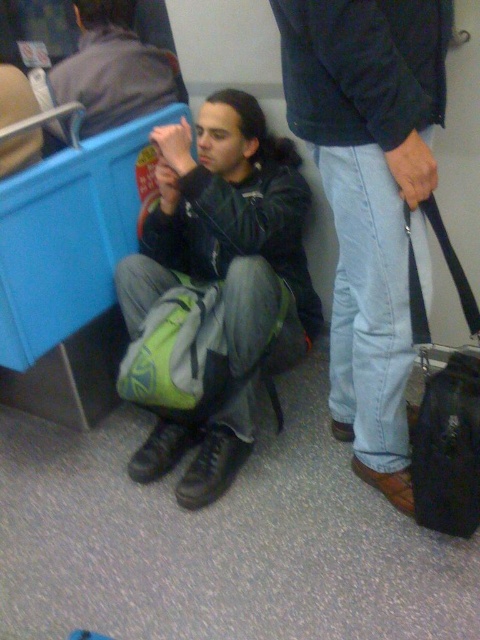
Question: Which of the following is the farthest from the observer?

Choices:
 (A) (182, 445)
 (B) (165, 310)
 (C) (112, 17)
 (D) (398, 38)

Answer: (C)

Question: Can you confirm if black matte jacket at center is positioned below green fabric backpack at center?

Choices:
 (A) yes
 (B) no

Answer: (B)

Question: Which of the following is the farthest from the observer?

Choices:
 (A) (118, 22)
 (B) (238, 404)

Answer: (A)

Question: Which object appears farthest from the camera in this image?

Choices:
 (A) light blue denim jeans at lower right
 (B) black matte jacket at center
 (C) matte black jacket at center
 (D) green fabric backpack at center

Answer: (C)

Question: Does light blue denim jeans at lower right appear over matte black jacket at center?

Choices:
 (A) yes
 (B) no

Answer: (B)

Question: Does light blue denim jeans at lower right have a lesser width compared to green fabric backpack at center?

Choices:
 (A) no
 (B) yes

Answer: (B)